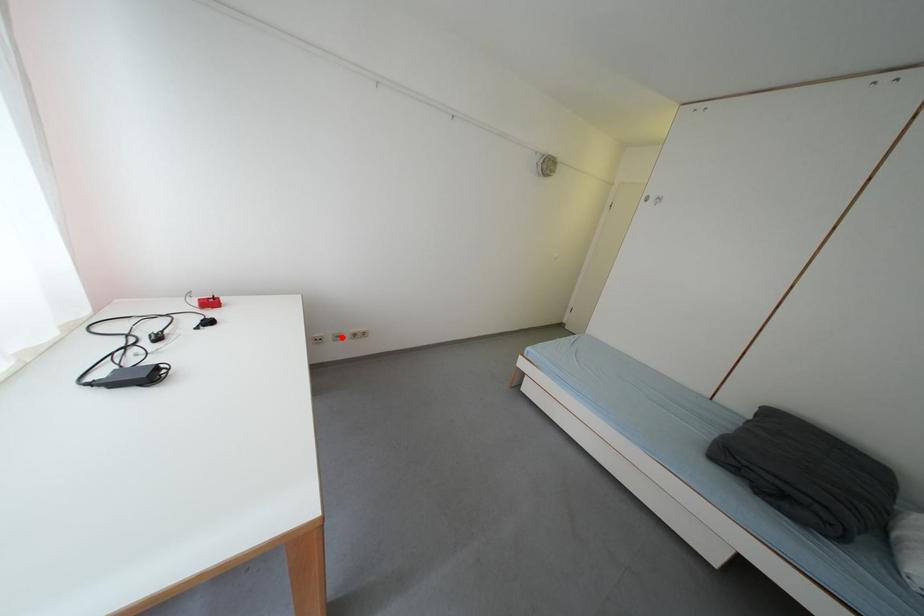
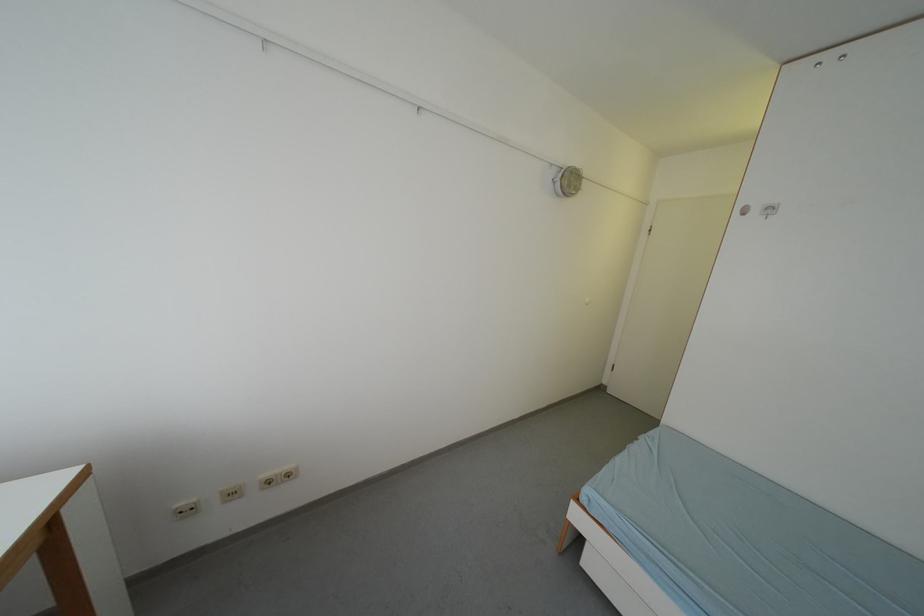
Question: I am providing you with two images of the same scene from different viewpoints. In image1, a red point is highlighted. Considering the same 3D point in image2, which of the following is correct?

Choices:
 (A) It is closer
 (B) It is farther

Answer: (A)